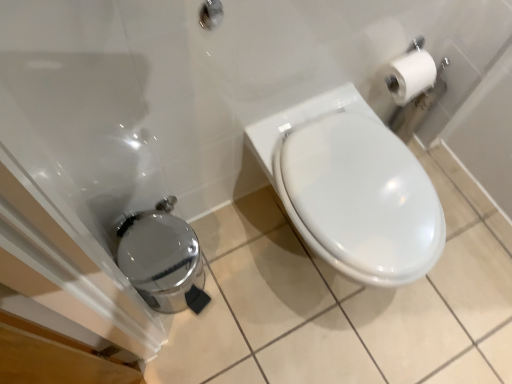
Question: Does brushed metal showerhead at upper center turn towards white glossy toilet at center?

Choices:
 (A) yes
 (B) no

Answer: (B)

Question: Does brushed metal showerhead at upper center have a larger size compared to white glossy toilet at center?

Choices:
 (A) yes
 (B) no

Answer: (B)

Question: Is brushed metal showerhead at upper center outside white glossy toilet at center?

Choices:
 (A) no
 (B) yes

Answer: (B)

Question: Could white glossy toilet at center be considered to be inside brushed metal showerhead at upper center?

Choices:
 (A) no
 (B) yes

Answer: (A)

Question: From a real-world perspective, is brushed metal showerhead at upper center positioned under white glossy toilet at center based on gravity?

Choices:
 (A) yes
 (B) no

Answer: (B)

Question: Is brushed metal showerhead at upper center wider than white glossy toilet at center?

Choices:
 (A) no
 (B) yes

Answer: (A)

Question: Can you confirm if brushed metal showerhead at upper center is bigger than polished stainless steel trash can at lower left?

Choices:
 (A) no
 (B) yes

Answer: (A)

Question: Is brushed metal showerhead at upper center thinner than polished stainless steel trash can at lower left?

Choices:
 (A) no
 (B) yes

Answer: (B)

Question: Considering the relative sizes of brushed metal showerhead at upper center and polished stainless steel trash can at lower left in the image provided, is brushed metal showerhead at upper center shorter than polished stainless steel trash can at lower left?

Choices:
 (A) yes
 (B) no

Answer: (A)

Question: From the image's perspective, is brushed metal showerhead at upper center on top of polished stainless steel trash can at lower left?

Choices:
 (A) yes
 (B) no

Answer: (A)

Question: Is brushed metal showerhead at upper center positioned beyond the bounds of polished stainless steel trash can at lower left?

Choices:
 (A) no
 (B) yes

Answer: (B)

Question: From a real-world perspective, is brushed metal showerhead at upper center beneath polished stainless steel trash can at lower left?

Choices:
 (A) yes
 (B) no

Answer: (B)

Question: Are white glossy toilet at center and brushed metal showerhead at upper center beside each other?

Choices:
 (A) no
 (B) yes

Answer: (A)